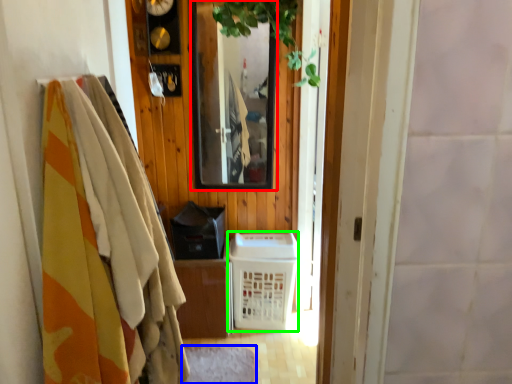
Question: Considering the real-world distances, which object is closest to mirror (highlighted by a red box)? mat (highlighted by a blue box) or basket (highlighted by a green box).

Choices:
 (A) mat
 (B) basket

Answer: (B)